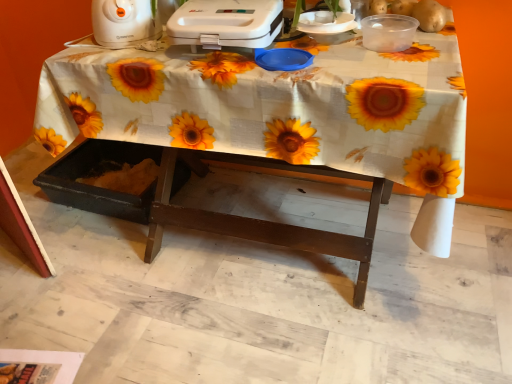
Question: Is white fabric-covered table at center not within white plastic toaster at upper left, positioned as the first appliance in left-to-right order?

Choices:
 (A) yes
 (B) no

Answer: (A)

Question: From the image's perspective, is white fabric-covered table at center under white plastic toaster at upper left, positioned as the first appliance in left-to-right order?

Choices:
 (A) no
 (B) yes

Answer: (B)

Question: Can you confirm if white fabric-covered table at center is smaller than white plastic toaster at upper left, positioned as the first appliance in left-to-right order?

Choices:
 (A) no
 (B) yes

Answer: (A)

Question: Is the position of white fabric-covered table at center less distant than that of white plastic toaster at upper left, arranged as the 2th appliance when viewed from the right?

Choices:
 (A) yes
 (B) no

Answer: (A)

Question: Considering the relative sizes of white fabric-covered table at center and white plastic toaster at upper left, arranged as the 2th appliance when viewed from the right, in the image provided, is white fabric-covered table at center wider than white plastic toaster at upper left, arranged as the 2th appliance when viewed from the right,?

Choices:
 (A) yes
 (B) no

Answer: (A)

Question: In terms of height, does white plastic toaster at upper center, which is the 2th appliance from left to right, look taller or shorter compared to white fabric-covered table at center?

Choices:
 (A) short
 (B) tall

Answer: (A)

Question: Considering the positions of point (211, 41) and point (229, 221), is point (211, 41) closer or farther from the camera than point (229, 221)?

Choices:
 (A) closer
 (B) farther

Answer: (A)

Question: From a real-world perspective, is white plastic toaster at upper center, the 1th appliance in the right-to-left sequence, physically located above or below white fabric-covered table at center?

Choices:
 (A) below
 (B) above

Answer: (B)

Question: From the image's perspective, is white plastic toaster at upper center, the 1th appliance in the right-to-left sequence, above or below white fabric-covered table at center?

Choices:
 (A) below
 (B) above

Answer: (B)

Question: Considering the positions of white plastic toaster at upper left, positioned as the first appliance in left-to-right order, and white fabric-covered table at center in the image, is white plastic toaster at upper left, positioned as the first appliance in left-to-right order, wider or thinner than white fabric-covered table at center?

Choices:
 (A) thin
 (B) wide

Answer: (A)

Question: From their relative heights in the image, would you say white plastic toaster at upper left, positioned as the first appliance in left-to-right order, is taller or shorter than white fabric-covered table at center?

Choices:
 (A) tall
 (B) short

Answer: (B)

Question: Visually, is white plastic toaster at upper left, arranged as the 2th appliance when viewed from the right, positioned to the left or to the right of white fabric-covered table at center?

Choices:
 (A) left
 (B) right

Answer: (A)

Question: From a real-world perspective, relative to white fabric-covered table at center, is white plastic toaster at upper left, arranged as the 2th appliance when viewed from the right, vertically above or below?

Choices:
 (A) below
 (B) above

Answer: (B)

Question: Considering their positions, is white fabric-covered table at center located in front of or behind white plastic toaster at upper left, arranged as the 2th appliance when viewed from the right?

Choices:
 (A) behind
 (B) front

Answer: (B)

Question: In terms of size, does white fabric-covered table at center appear bigger or smaller than white plastic toaster at upper left, positioned as the first appliance in left-to-right order?

Choices:
 (A) small
 (B) big

Answer: (B)